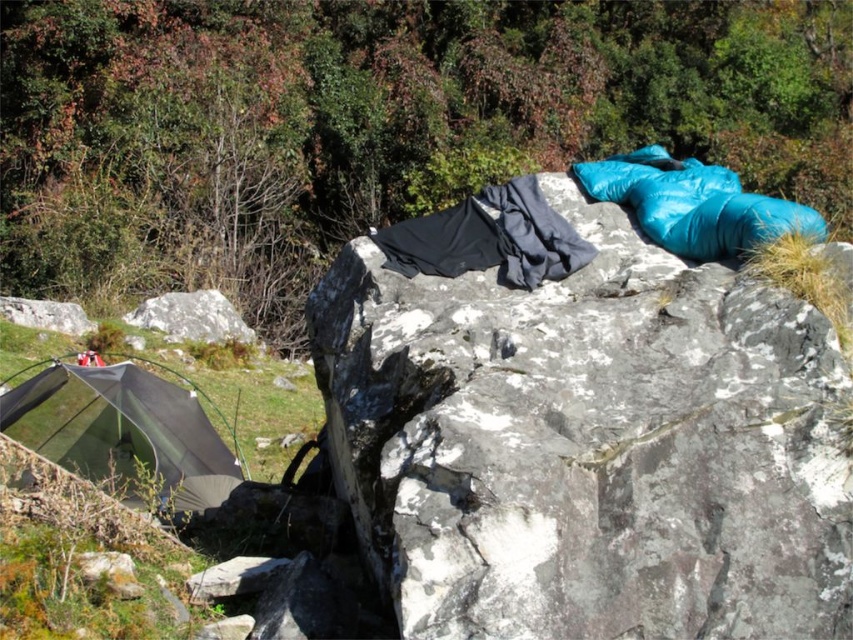
You are standing at the camera position looking at the camping area. There are two points marked in the image, one at coordinates point (x=444, y=544) and the other at point (x=235, y=310). Which of these two points is nearer to your current position?

Point (x=444, y=544) is closer to the camera than point (x=235, y=310), so the point at coordinates point (x=444, y=544) is nearer to your current position.

You are a hiker who wants to place a heavy backpack between the smooth gray rock at upper center and the gray rough rock at lower left. Which rock should you place it closer to if you want the backpack to be more visible from where you are standing?

You should place the backpack closer to the smooth gray rock at upper center because it is closer to the viewer, making the backpack more visible from your current position.

You are a hiker who wants to place your tent on the smooth gray rock at upper center. Can you set up your tent there?

The smooth gray rock at upper center is 8.95 feet away from the tent, so you can set up your tent there as there is enough space between them.